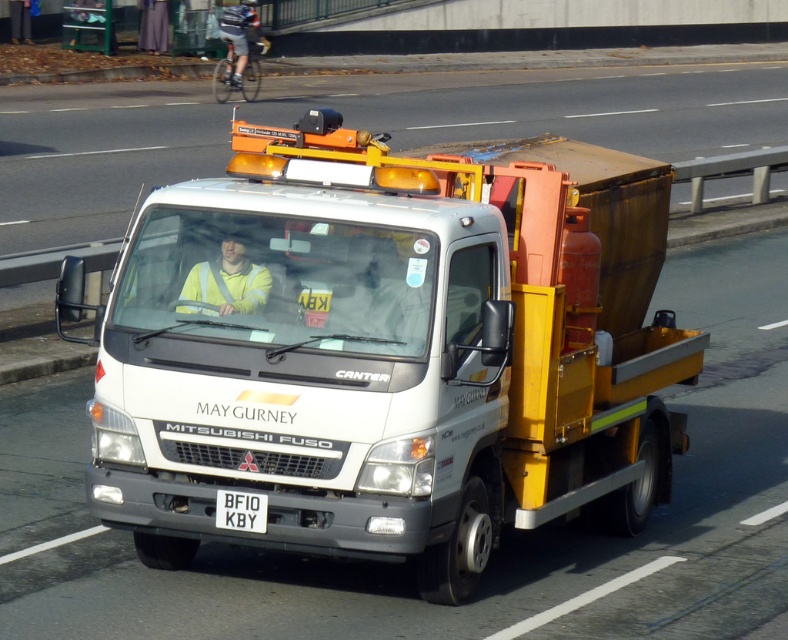
Question: Which object is closer to the camera taking this photo?

Choices:
 (A) white matte truck at center
 (B) yellow high-visibility jacket at center

Answer: (A)

Question: Estimate the real-world distances between objects in this image. Which object is closer to the white matte truck at center?

Choices:
 (A) white plastic license plate at center
 (B) yellow high-visibility jacket at center
 (C) yellow reflective vest at center

Answer: (C)

Question: Can you confirm if yellow reflective vest at center is positioned to the right of yellow high-visibility jacket at center?

Choices:
 (A) yes
 (B) no

Answer: (A)

Question: Does yellow high-visibility jacket at center have a greater width compared to white plastic license plate at center?

Choices:
 (A) yes
 (B) no

Answer: (A)

Question: Which object appears closest to the camera in this image?

Choices:
 (A) yellow reflective vest at center
 (B) yellow high-visibility jacket at center

Answer: (A)

Question: Is white matte truck at center above yellow high-visibility jacket at center?

Choices:
 (A) no
 (B) yes

Answer: (A)